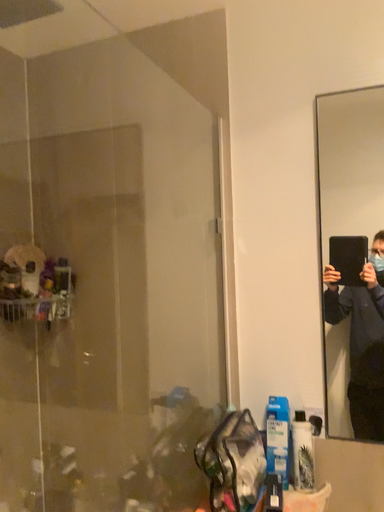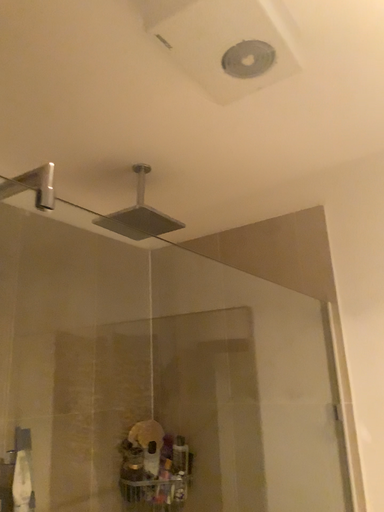
Question: How did the camera likely rotate when shooting the video?

Choices:
 (A) rotated right
 (B) rotated left

Answer: (B)